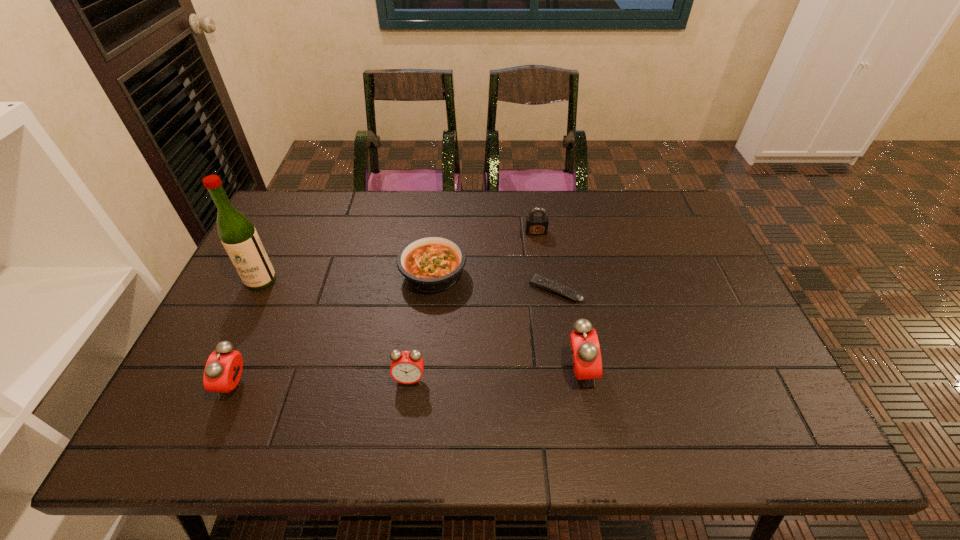
Find the location of a particular element. the second tallest alarm clock is located at coordinates (223, 369).

Identify the location of the leftmost alarm clock. This screenshot has height=540, width=960. click(223, 369).

Locate an element on the screen. The width and height of the screenshot is (960, 540). the second alarm clock from right to left is located at coordinates (407, 367).

The width and height of the screenshot is (960, 540). Find the location of `the sixth shortest object`. the sixth shortest object is located at coordinates (585, 350).

Locate an element on the screen. This screenshot has height=540, width=960. the rightmost alarm clock is located at coordinates (585, 350).

Where is `padlock`? The height and width of the screenshot is (540, 960). padlock is located at coordinates (535, 225).

Find the location of `the second shortest object`. the second shortest object is located at coordinates (431, 263).

Locate an element on the screen. liquor is located at coordinates (239, 237).

Where is `remote control`? The image size is (960, 540). remote control is located at coordinates (542, 282).

I want to click on free space located on the front-facing side of the second tallest alarm clock, so click(x=192, y=385).